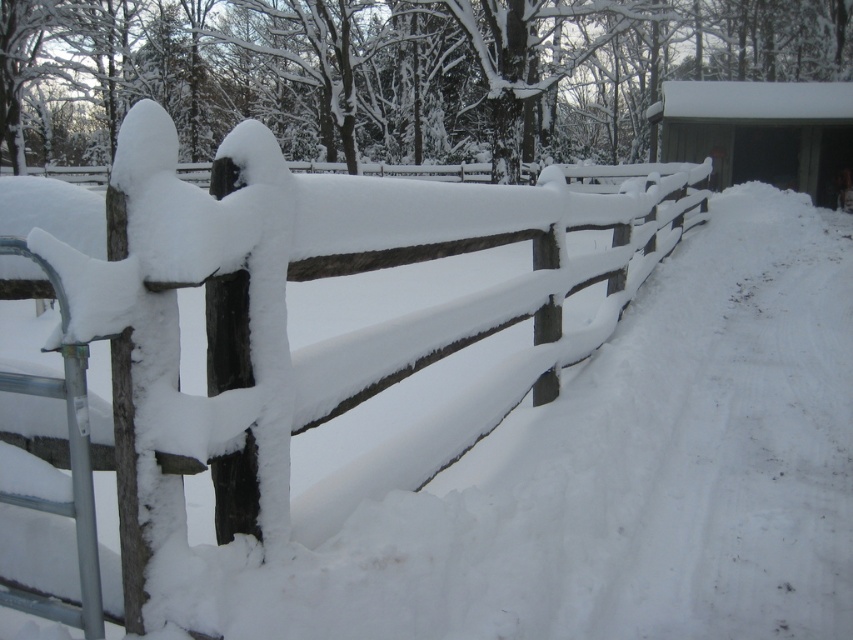
You are standing in the winter scene and want to walk from the wooden fence at center to the wooden cabin at upper right. In which direction should you head to reach the cabin?

The wooden fence at center is positioned on the left side of wooden cabin at upper right, so you should head to the right to reach the cabin.

You are standing in the winter scene and want to walk towards the wooden cabin at upper right. Which direction should you move relative to the wooden fence at center?

You should move upwards from the wooden fence at center towards the wooden cabin at upper right since the wooden cabin at upper right is located above the wooden fence at center.

You are an architect designing a winter landscape. You need to place a new snow sculpture between the wooden fence at center and the wooden cabin at upper right. Which object should the sculpture be closer to if it needs to be near the thinner structure?

The wooden fence at center is thinner than the wooden cabin at upper right, so the snow sculpture should be placed closer to the wooden fence at center.